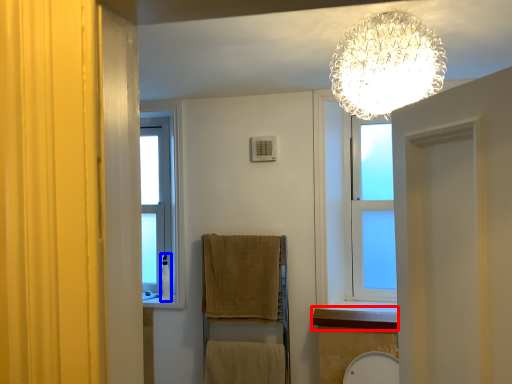
Question: Which object is further to the camera taking this photo, window sill (highlighted by a red box) or toiletry (highlighted by a blue box)?

Choices:
 (A) window sill
 (B) toiletry

Answer: (B)